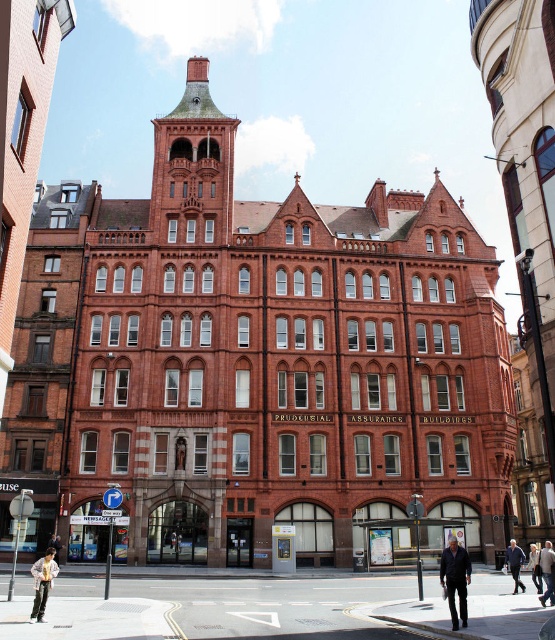
Does dark blue jeans at lower center come behind light beige fabric jacket at lower right?

No, dark blue jeans at lower center is in front of light beige fabric jacket at lower right.

Does dark blue jeans at lower center appear under light beige fabric jacket at lower right?

Incorrect, dark blue jeans at lower center is not positioned below light beige fabric jacket at lower right.

Is point (461, 588) more distant than point (537, 556)?

No, (461, 588) is closer to viewer.

Where is `dark blue jeans at lower center`? dark blue jeans at lower center is located at coordinates (456, 579).

Does light brown leather pants at lower left appear on the left side of light beige fabric coat at lower right?

Correct, you'll find light brown leather pants at lower left to the left of light beige fabric coat at lower right.

Between point (47, 552) and point (548, 573), which one is positioned behind?

Positioned behind is point (47, 552).

Identify the location of light brown leather pants at lower left. (42, 582).

Between point (466, 611) and point (548, 592), which one is positioned behind?

Positioned behind is point (548, 592).

Can you confirm if dark blue jeans at lower center is positioned to the right of light beige fabric coat at lower right?

Incorrect, dark blue jeans at lower center is not on the right side of light beige fabric coat at lower right.

Which is in front, point (461, 547) or point (551, 561)?

Point (461, 547) is more forward.

Where is `dark blue jeans at lower center`? This screenshot has width=555, height=640. dark blue jeans at lower center is located at coordinates (456, 579).